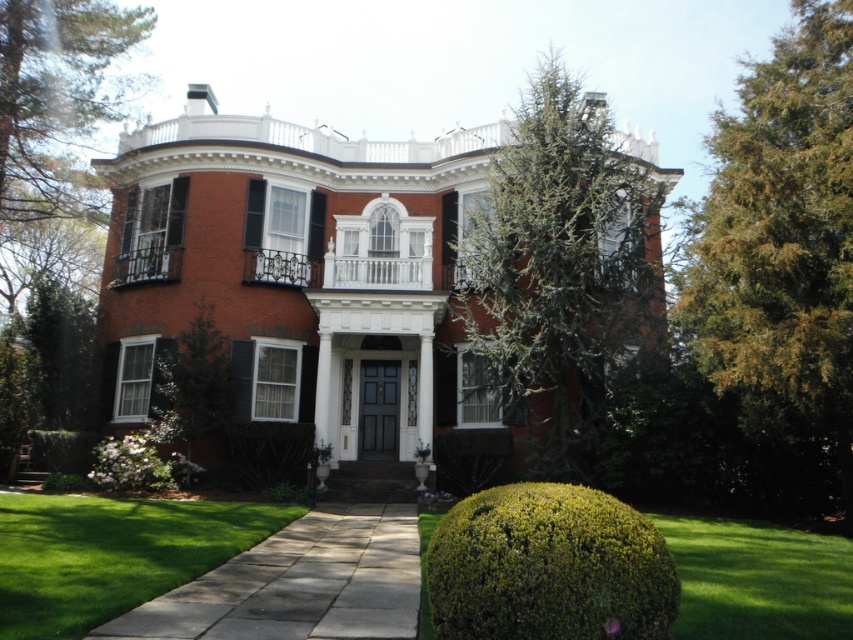
Who is taller, green leafy bush at lower center or white wood shutter at center?

white wood shutter at center is taller.

Can you confirm if green leafy bush at lower center is taller than white wood shutter at center?

In fact, green leafy bush at lower center may be shorter than white wood shutter at center.

Locate an element on the screen. green leafy bush at lower center is located at coordinates (549, 566).

The image size is (853, 640). I want to click on green leafy bush at lower center, so click(549, 566).

Between green needle-like foliage at upper center and green grass at lower right, which one is positioned lower?

green grass at lower right

Does green needle-like foliage at upper center have a larger size compared to green grass at lower right?

Indeed, green needle-like foliage at upper center has a larger size compared to green grass at lower right.

Where is `green needle-like foliage at upper center`? green needle-like foliage at upper center is located at coordinates (560, 268).

Find the location of a particular element. The height and width of the screenshot is (640, 853). green needle-like foliage at upper center is located at coordinates (560, 268).

Describe the element at coordinates (560, 268) in the screenshot. I see `green needle-like foliage at upper center` at that location.

Locate an element on the screen. This screenshot has width=853, height=640. green needle-like foliage at upper center is located at coordinates (560, 268).

Is point (465, 266) positioned before point (86, 236)?

Yes.

Where is `green needle-like foliage at upper center`? Image resolution: width=853 pixels, height=640 pixels. green needle-like foliage at upper center is located at coordinates (560, 268).